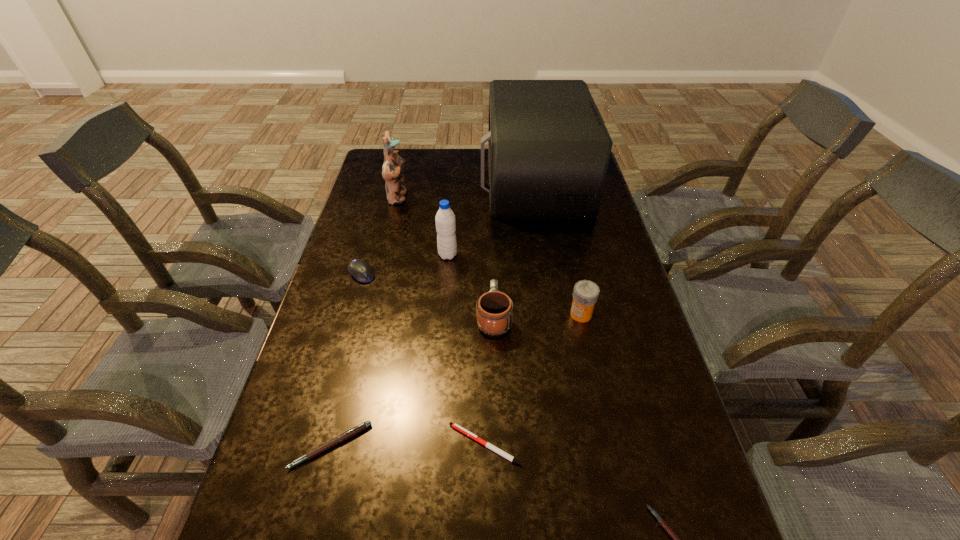
Locate an element on the screen. This screenshot has width=960, height=540. the bigger pink pen is located at coordinates (350, 433).

Locate an element on the screen. The height and width of the screenshot is (540, 960). the second pen from right to left is located at coordinates [x=454, y=425].

You are a GUI agent. You are given a task and a screenshot of the screen. Output one action in this format:
    pyautogui.click(x=<x>, y=<y>)
    Task: Click on the vacant point located 0.150m on the front-facing side of the microwave oven
    The image size is (960, 540).
    Given the screenshot: What is the action you would take?
    pos(441,180)

Find the location of a particular element. The height and width of the screenshot is (540, 960). free space located 0.200m on the front-facing side of the microwave oven is located at coordinates (427, 180).

The image size is (960, 540). What are the coordinates of `free space located 0.300m on the front-facing side of the microwave oven` in the screenshot? It's located at (401, 180).

Locate an element on the screen. Image resolution: width=960 pixels, height=540 pixels. vacant space located 0.150m on the front-facing side of the pink figurine is located at coordinates (450, 198).

I want to click on free spot located 0.340m on the back of the water bottle, so pyautogui.click(x=453, y=189).

Identify the location of free space located 0.380m on the label side of the orange medicine. Image resolution: width=960 pixels, height=540 pixels. (427, 314).

Locate an element on the screen. This screenshot has width=960, height=540. vacant space located 0.120m on the label side of the orange medicine is located at coordinates (524, 314).

Find the location of a particular element. vacant area located on the label side of the orange medicine is located at coordinates (443, 314).